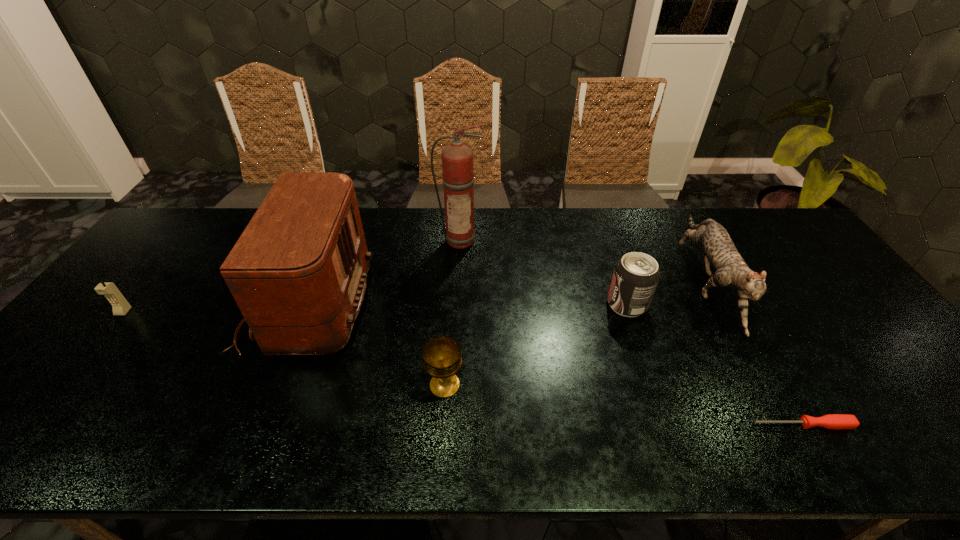
I want to click on fire extinguisher, so click(457, 158).

At what (x,y) coordinates should I click in order to perform the action: click on the second object from left to right. Please return your answer as a coordinate pair (x, y). This screenshot has width=960, height=540. Looking at the image, I should click on (298, 272).

Identify the location of radio receiver. (298, 272).

Where is `cat`? cat is located at coordinates (731, 270).

I want to click on the leftmost object, so click(120, 306).

Image resolution: width=960 pixels, height=540 pixels. What are the coordinates of `the fifth object from left to right` in the screenshot? It's located at (636, 275).

Where is `the sixth farthest object`? The image size is (960, 540). the sixth farthest object is located at coordinates (442, 357).

Locate an element on the screen. This screenshot has width=960, height=540. the second shortest object is located at coordinates (442, 357).

Locate an element on the screen. The height and width of the screenshot is (540, 960). screwdriver is located at coordinates (831, 421).

The image size is (960, 540). What are the coordinates of `the shortest object` in the screenshot? It's located at (831, 421).